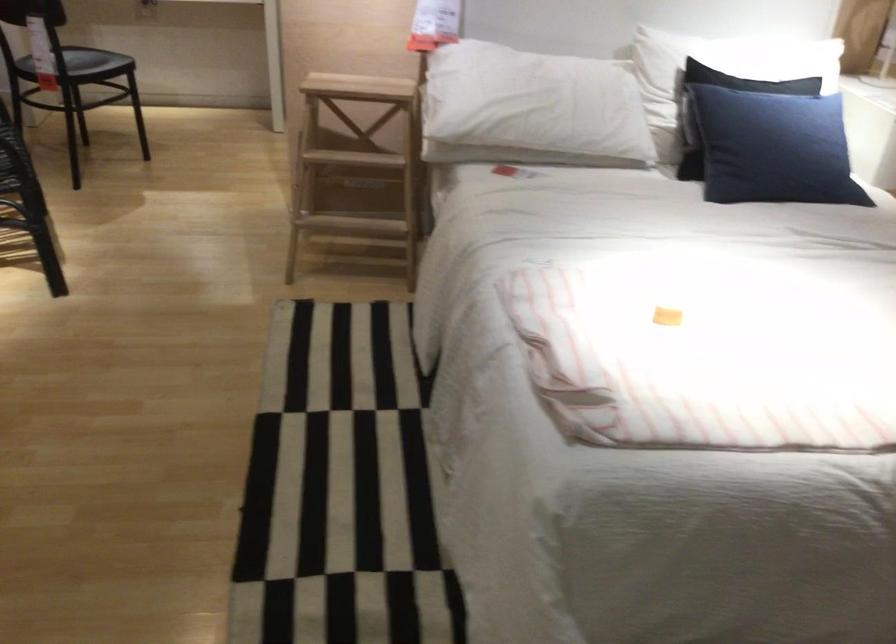
Locate an element on the screen. This screenshot has height=644, width=896. white pillow is located at coordinates (531, 108).